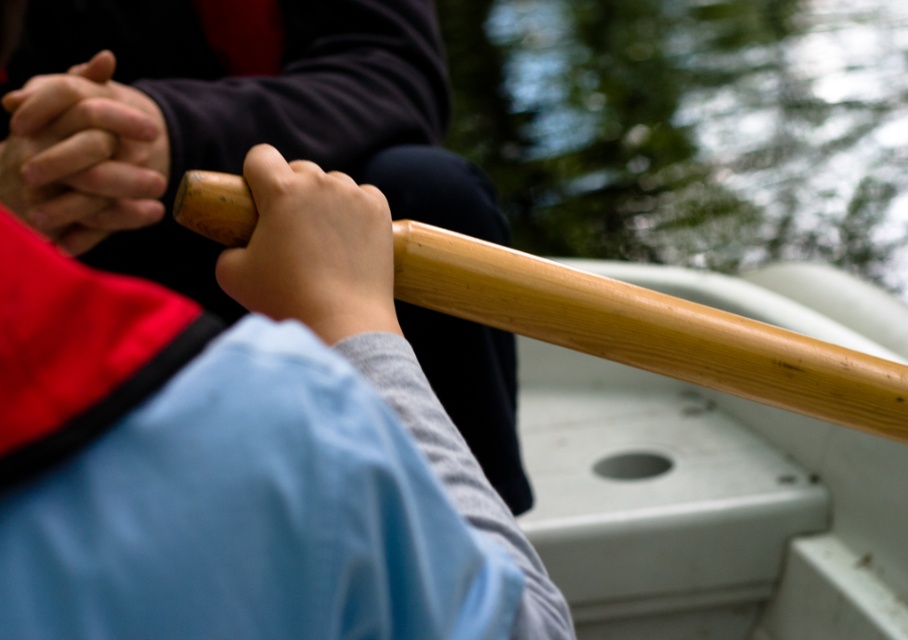
Can you confirm if wooden paddle at upper center is positioned above wooden paddle handle at center?

Yes, wooden paddle at upper center is above wooden paddle handle at center.

Who is lower down, wooden paddle at upper center or wooden paddle handle at center?

Positioned lower is wooden paddle handle at center.

Find the location of `wooden paddle at upper center`. wooden paddle at upper center is located at coordinates (240, 371).

Which of these two, matte black hands at center or wooden paddle handle at center, stands taller?

matte black hands at center is taller.

Is matte black hands at center positioned behind wooden paddle handle at center?

Yes, matte black hands at center is further from the viewer.

Which is in front, point (33, 216) or point (357, 224)?

Positioned in front is point (357, 224).

Find the location of a particular element. The width and height of the screenshot is (908, 640). matte black hands at center is located at coordinates (84, 154).

Is wooden paddle at upper center positioned at the back of matte black hands at center?

Yes, wooden paddle at upper center is further from the viewer.

Which is in front, point (316, 250) or point (87, 147)?

Point (316, 250) is more forward.

The width and height of the screenshot is (908, 640). In order to click on wooden paddle at upper center in this screenshot , I will do `click(240, 371)`.